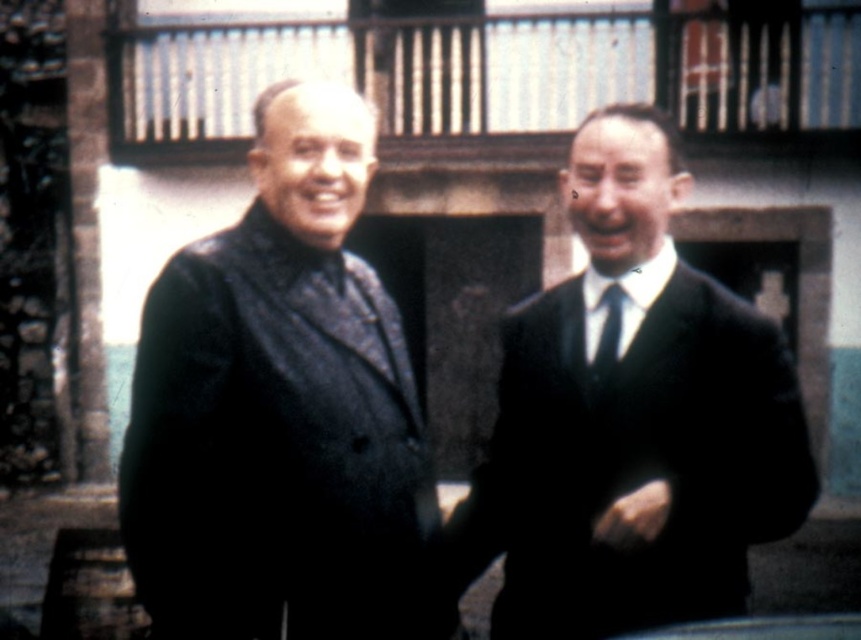
Question: Which point is closer to the camera taking this photo?

Choices:
 (A) (589, 372)
 (B) (265, 556)
 (C) (791, 522)

Answer: (B)

Question: From the image, what is the correct spatial relationship of matte black suit at right in relation to black silk tie at center?

Choices:
 (A) left
 (B) right

Answer: (B)

Question: Which point is farther to the camera?

Choices:
 (A) matte black suit at right
 (B) black silk tie at center

Answer: (B)

Question: Does matte black coat at left appear on the left side of black silk tie at center?

Choices:
 (A) yes
 (B) no

Answer: (A)

Question: Does matte black coat at left have a lesser width compared to black silk tie at center?

Choices:
 (A) no
 (B) yes

Answer: (A)

Question: Among these objects, which one is nearest to the camera?

Choices:
 (A) matte black suit at right
 (B) matte black coat at left
 (C) black silk tie at center

Answer: (B)